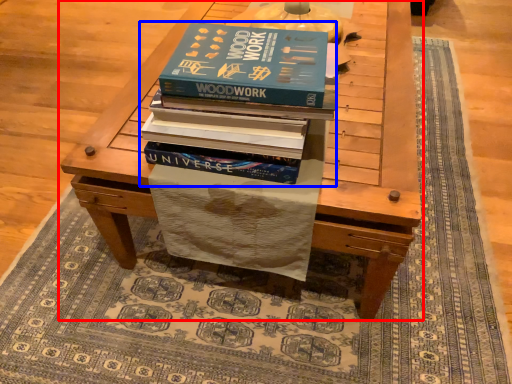
Question: Which point is closer to the camera, table (highlighted by a red box) or book (highlighted by a blue box)?

Choices:
 (A) table
 (B) book

Answer: (B)